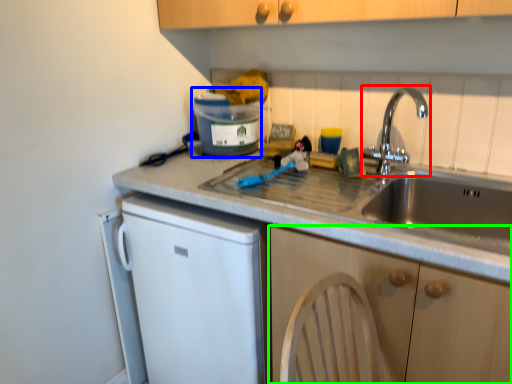
Question: Based on their relative distances, which object is farther from tap (highlighted by a red box)? Choose from appliance (highlighted by a blue box) and cabinetry (highlighted by a green box).

Choices:
 (A) appliance
 (B) cabinetry

Answer: (B)